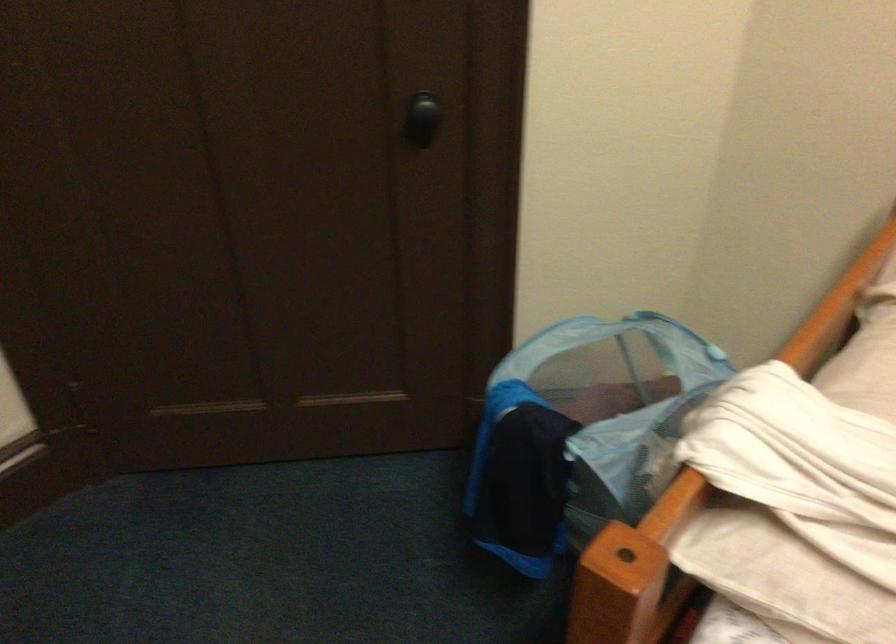
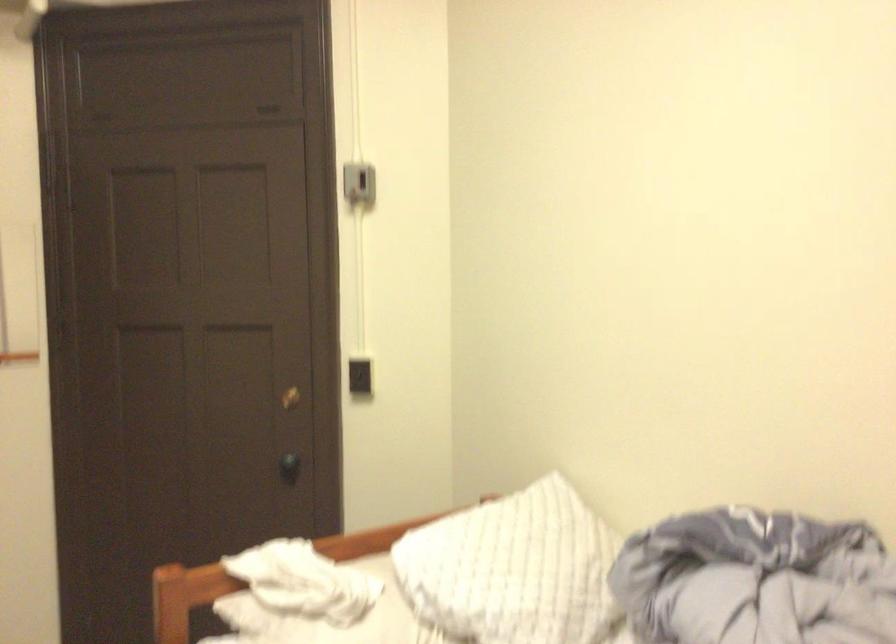
In the second image, find the point that corresponds to pixel 460 111 in the first image.

(289, 467)